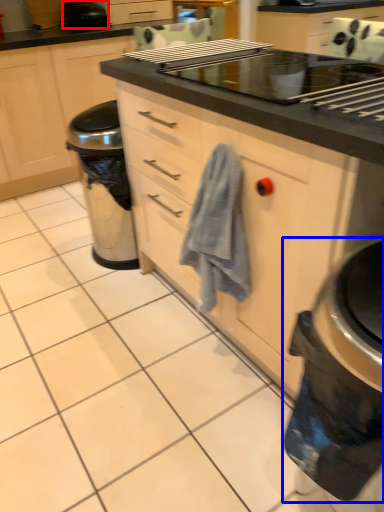
Question: Among these objects, which one is nearest to the camera, kitchen appliance (highlighted by a red box) or home appliance (highlighted by a blue box)?

Choices:
 (A) kitchen appliance
 (B) home appliance

Answer: (B)